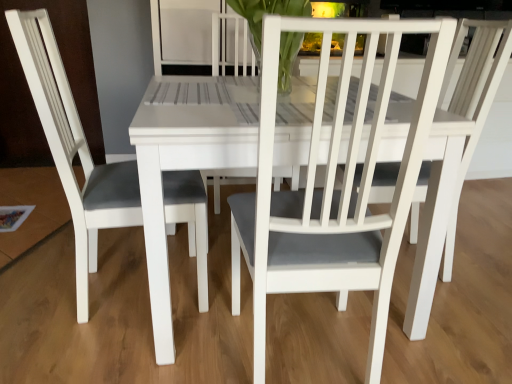
In order to face white matte chair at left, placed as the 1th chair when sorted from left to right, should I rotate leftwards or rightwards?

You should rotate left by 17.094 degrees.

The height and width of the screenshot is (384, 512). I want to click on clear glass vase at center, so click(x=267, y=13).

This screenshot has height=384, width=512. Find the location of `white matte chair at left, the second chair positioned from the right`. white matte chair at left, the second chair positioned from the right is located at coordinates (73, 148).

From the image's perspective, is clear glass vase at center located above or below white matte chair at left, placed as the 1th chair when sorted from left to right?

Clearly, from the image's perspective, clear glass vase at center is above white matte chair at left, placed as the 1th chair when sorted from left to right.

From a real-world perspective, does clear glass vase at center sit lower than white matte chair at left, placed as the 1th chair when sorted from left to right?

No.

Considering the points (265, 6) and (206, 257), which point is in front, point (265, 6) or point (206, 257)?

The point (206, 257) is closer to the camera.

From their relative heights in the image, would you say clear glass vase at center is taller or shorter than white matte chair at left, the second chair positioned from the right?

Clearly, clear glass vase at center is shorter compared to white matte chair at left, the second chair positioned from the right.

Between white matte chair at center, which ranks as the second chair in left-to-right order, and clear glass vase at center, which one has less height?

clear glass vase at center.

Does point (403, 215) appear closer or farther from the camera than point (283, 72)?

Point (403, 215) is positioned closer to the camera compared to point (283, 72).

Is white matte chair at center, which is the first chair from right to left, completely or partially outside of clear glass vase at center?

white matte chair at center, which is the first chair from right to left, is positioned outside clear glass vase at center.

From the image's perspective, between white matte chair at center, which ranks as the second chair in left-to-right order, and clear glass vase at center, who is located below?

white matte chair at center, which ranks as the second chair in left-to-right order, is shown below in the image.

From the image's perspective, is white matte chair at left, the second chair positioned from the right, under clear glass vase at center?

Indeed, from the image's perspective, white matte chair at left, the second chair positioned from the right, is shown beneath clear glass vase at center.

Would you consider white matte chair at left, placed as the 1th chair when sorted from left to right, to be distant from clear glass vase at center?

white matte chair at left, placed as the 1th chair when sorted from left to right, is positioned a significant distance from clear glass vase at center.

Based on the photo, considering the relative sizes of white matte chair at left, placed as the 1th chair when sorted from left to right, and clear glass vase at center in the image provided, is white matte chair at left, placed as the 1th chair when sorted from left to right, thinner than clear glass vase at center?

In fact, white matte chair at left, placed as the 1th chair when sorted from left to right, might be wider than clear glass vase at center.

Do you think clear glass vase at center is within white matte chair at center, which ranks as the second chair in left-to-right order, or outside of it?

clear glass vase at center is not inside white matte chair at center, which ranks as the second chair in left-to-right order, it's outside.

In the scene shown: Which object is closer to the camera taking this photo, clear glass vase at center or white matte chair at center, which ranks as the second chair in left-to-right order?

white matte chair at center, which ranks as the second chair in left-to-right order, is more forward.

Can you confirm if clear glass vase at center is positioned to the left of white matte chair at center, which ranks as the second chair in left-to-right order?

Correct, you'll find clear glass vase at center to the left of white matte chair at center, which ranks as the second chair in left-to-right order.

From a real-world perspective, who is located higher, white matte chair at center, which ranks as the second chair in left-to-right order, or white matte chair at left, the second chair positioned from the right?

From a 3D spatial view, white matte chair at left, the second chair positioned from the right, is above.

Between point (287, 281) and point (77, 218), which one is positioned in front?

The point (287, 281) is in front.

In terms of size, does white matte chair at center, which ranks as the second chair in left-to-right order, appear bigger or smaller than white matte chair at left, placed as the 1th chair when sorted from left to right?

white matte chair at center, which ranks as the second chair in left-to-right order, is bigger than white matte chair at left, placed as the 1th chair when sorted from left to right.

How far apart are white matte chair at left, placed as the 1th chair when sorted from left to right, and white matte chair at center, which is the first chair from right to left?

A distance of 20.36 inches exists between white matte chair at left, placed as the 1th chair when sorted from left to right, and white matte chair at center, which is the first chair from right to left.

Which is closer, (7, 20) or (378, 322)?

Point (7, 20) is positioned farther from the camera compared to point (378, 322).

Is white matte chair at left, the second chair positioned from the right, oriented away from white matte chair at center, which is the first chair from right to left?

No, white matte chair at left, the second chair positioned from the right, is not facing away from white matte chair at center, which is the first chair from right to left.

Where is `chair that appears on the right of white matte chair at left, placed as the 1th chair when sorted from left to right`? chair that appears on the right of white matte chair at left, placed as the 1th chair when sorted from left to right is located at coordinates (333, 184).

In the image, there is a white matte chair at left, the second chair positioned from the right. What are the coordinates of `orchid above it (from the image's perspective)` in the screenshot? It's located at (267, 13).

Where is `orchid on the left of the white matte chair at center, which ranks as the second chair in left-to-right order`? The image size is (512, 384). orchid on the left of the white matte chair at center, which ranks as the second chair in left-to-right order is located at coordinates (267, 13).

Estimate the real-world distances between objects in this image. Which object is closer to white matte chair at left, the second chair positioned from the right, white matte chair at center, which is the first chair from right to left, or clear glass vase at center?

white matte chair at center, which is the first chair from right to left.

Which object lies nearer to the anchor point white matte chair at center, which is the first chair from right to left, clear glass vase at center or white matte chair at left, placed as the 1th chair when sorted from left to right?

white matte chair at left, placed as the 1th chair when sorted from left to right, lies closer to white matte chair at center, which is the first chair from right to left, than the other object.

Which object lies nearer to the anchor point white matte chair at left, placed as the 1th chair when sorted from left to right, clear glass vase at center or white matte chair at center, which ranks as the second chair in left-to-right order?

The object closer to white matte chair at left, placed as the 1th chair when sorted from left to right, is white matte chair at center, which ranks as the second chair in left-to-right order.

When comparing their distances from clear glass vase at center, does white matte chair at center, which is the first chair from right to left, or white matte chair at left, the second chair positioned from the right, seem closer?

The object closer to clear glass vase at center is white matte chair at left, the second chair positioned from the right.

Based on their spatial positions, is white matte chair at left, the second chair positioned from the right, or white matte chair at center, which is the first chair from right to left, closer to clear glass vase at center?

Among the two, white matte chair at left, the second chair positioned from the right, is located nearer to clear glass vase at center.

Looking at the image, which one is located closer to white matte chair at center, which is the first chair from right to left, white matte chair at left, placed as the 1th chair when sorted from left to right, or clear glass vase at center?

The object closer to white matte chair at center, which is the first chair from right to left, is white matte chair at left, placed as the 1th chair when sorted from left to right.

Identify the location of orchid between white matte chair at left, the second chair positioned from the right, and white matte chair at center, which ranks as the second chair in left-to-right order, in the horizontal direction. The width and height of the screenshot is (512, 384). (267, 13).